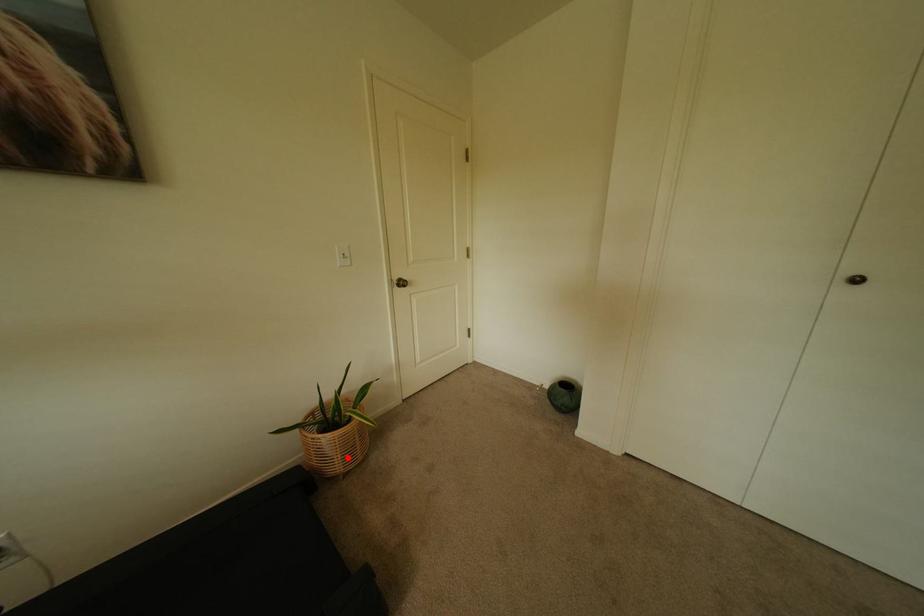
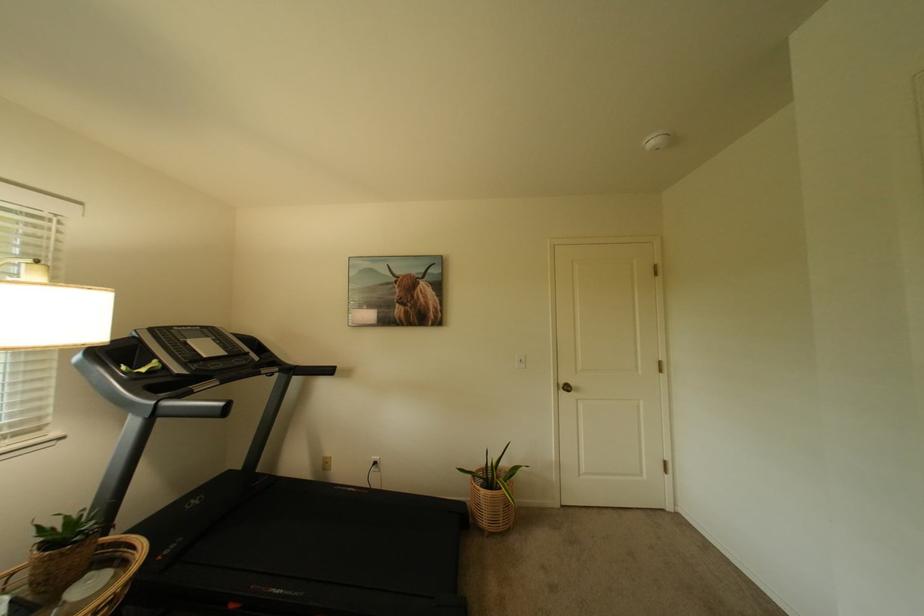
Question: I am providing you with two images of the same scene from different viewpoints. Image1 has a red point marked. In image2, the corresponding 3D location appears at what relative position? Reply with the corresponding letter.

Choices:
 (A) Closer
 (B) Farther

Answer: (B)